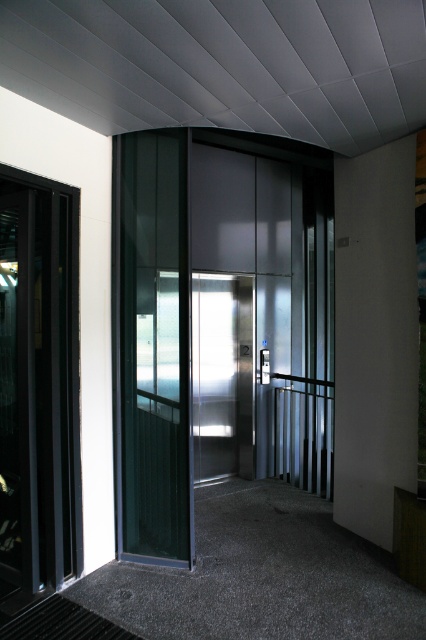
Measure the distance between satin silver elevator at center and transparent glass elevator at center.

satin silver elevator at center is 1.77 meters from transparent glass elevator at center.

Who is taller, satin silver elevator at center or transparent glass elevator at center?

satin silver elevator at center

Between point (149, 388) and point (123, 252), which one is positioned behind?

Positioned behind is point (123, 252).

I want to click on satin silver elevator at center, so click(x=219, y=324).